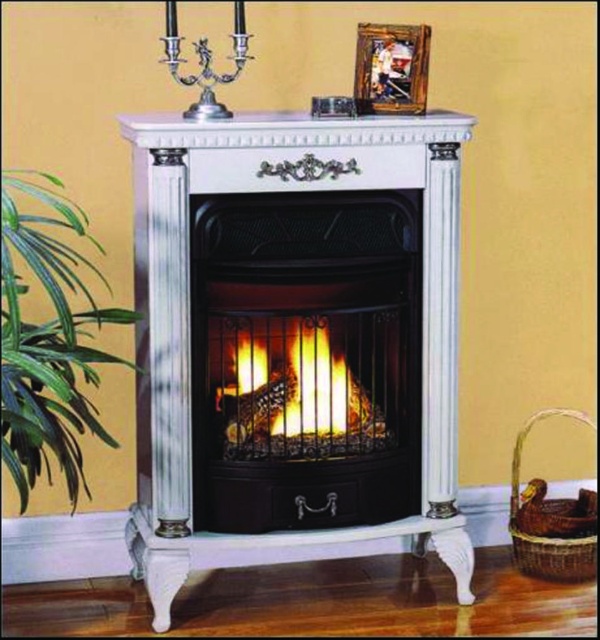
Which is more to the left, green leafy plant at left or silver metallic candle holder at upper center?

green leafy plant at left is more to the left.

Does green leafy plant at left have a greater height compared to silver metallic candle holder at upper center?

Indeed, green leafy plant at left has a greater height compared to silver metallic candle holder at upper center.

Is point (25, 186) positioned in front of point (202, 38)?

Yes, point (25, 186) is closer to viewer.

This screenshot has width=600, height=640. What are the coordinates of `green leafy plant at left` in the screenshot? It's located at (49, 339).

Which is above, wooden photo frame at upper center or silver metallic candle holder at upper center?

silver metallic candle holder at upper center

Consider the image. Between wooden photo frame at upper center and silver metallic candle holder at upper center, which one has less height?

wooden photo frame at upper center

Locate an element on the screen. The image size is (600, 640). wooden photo frame at upper center is located at coordinates (391, 68).

Find the location of a particular element. wooden photo frame at upper center is located at coordinates (391, 68).

Who is positioned more to the right, orange glowing wood at center or wooden photo frame at upper center?

wooden photo frame at upper center is more to the right.

This screenshot has height=640, width=600. Describe the element at coordinates (294, 388) in the screenshot. I see `orange glowing wood at center` at that location.

At what (x,y) coordinates should I click in order to perform the action: click on orange glowing wood at center. Please return your answer as a coordinate pair (x, y). Looking at the image, I should click on (294, 388).